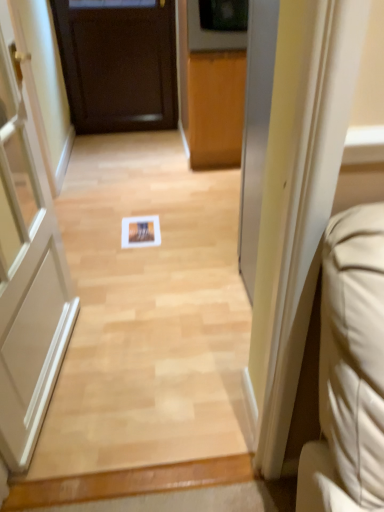
This screenshot has width=384, height=512. I want to click on white matte door at left, positioned as the 2th door in top-to-bottom order, so click(x=27, y=273).

From the picture: Measure the distance between white matte door at left, which is counted as the first door, starting from the bottom, and camera.

1.14 meters.

Describe the element at coordinates (27, 273) in the screenshot. The width and height of the screenshot is (384, 512). I see `white matte door at left, the 2th door viewed from the back` at that location.

Measure the distance between point (x=78, y=61) and camera.

Point (x=78, y=61) is 3.20 meters from camera.

Image resolution: width=384 pixels, height=512 pixels. What do you see at coordinates (118, 63) in the screenshot? I see `dark wood door at center, the 1th door viewed from the top` at bounding box center [118, 63].

Measure the distance between dark wood door at center, the 1th door viewed from the top, and camera.

dark wood door at center, the 1th door viewed from the top, is 9.84 feet away from camera.

This screenshot has height=512, width=384. I want to click on dark wood door at center, the 1th door viewed from the top, so click(118, 63).

Locate an element on the screen. This screenshot has height=512, width=384. white matte door at left, the 2th door viewed from the back is located at coordinates (27, 273).

In the image, is white matte door at left, which is counted as the first door, starting from the bottom, on the left side or the right side of dark wood door at center, which appears as the second door when ordered from the bottom?

white matte door at left, which is counted as the first door, starting from the bottom, is positioned on dark wood door at center, which appears as the second door when ordered from the bottom,'s right side.

Is white matte door at left, the 2th door viewed from the back, further to the viewer compared to dark wood door at center, the 1th door viewed from the top?

No, white matte door at left, the 2th door viewed from the back, is closer to the camera.

Which point is more forward, (49,362) or (159,29)?

Point (49,362)

From the image's perspective, would you say white matte door at left, the first door positioned from the front, is positioned over dark wood door at center, the second door viewed from the front?

No, from the image's perspective, white matte door at left, the first door positioned from the front, is not above dark wood door at center, the second door viewed from the front.

From a real-world perspective, is white matte door at left, which is counted as the first door, starting from the bottom, over dark wood door at center, which appears as the second door when ordered from the bottom?

Yes, from a real-world perspective, white matte door at left, which is counted as the first door, starting from the bottom, is over dark wood door at center, which appears as the second door when ordered from the bottom

Considering the relative sizes of white matte door at left, which is counted as the first door, starting from the bottom, and dark wood door at center, which appears as the second door when ordered from the bottom, in the image provided, is white matte door at left, which is counted as the first door, starting from the bottom, wider than dark wood door at center, which appears as the second door when ordered from the bottom,?

Yes, white matte door at left, which is counted as the first door, starting from the bottom, is wider than dark wood door at center, which appears as the second door when ordered from the bottom.

Can you confirm if white matte door at left, the first door positioned from the front, is taller than dark wood door at center, the 1th door viewed from the top?

Correct, white matte door at left, the first door positioned from the front, is much taller as dark wood door at center, the 1th door viewed from the top.

Is white matte door at left, the 2th door viewed from the back, bigger than dark wood door at center, the 1th door viewed from the top?

Correct, white matte door at left, the 2th door viewed from the back, is larger in size than dark wood door at center, the 1th door viewed from the top.

Is white matte door at left, positioned as the 2th door in top-to-bottom order, outside of dark wood door at center, the second door viewed from the front?

Yes, white matte door at left, positioned as the 2th door in top-to-bottom order, is located beyond the bounds of dark wood door at center, the second door viewed from the front.

Are white matte door at left, the 2th door viewed from the back, and dark wood door at center, which appears as the second door when ordered from the bottom, far apart?

Yes, white matte door at left, the 2th door viewed from the back, is far from dark wood door at center, which appears as the second door when ordered from the bottom.

Is white matte door at left, which is counted as the first door, starting from the bottom, oriented towards dark wood door at center, the second door viewed from the front?

No.

How different are the orientations of white matte door at left, which is counted as the first door, starting from the bottom, and dark wood door at center, the second door viewed from the front, in degrees?

There is a 83.7-degree angle between the facing directions of white matte door at left, which is counted as the first door, starting from the bottom, and dark wood door at center, the second door viewed from the front.

How far apart are white matte door at left, which is counted as the first door, starting from the bottom, and dark wood door at center, which appears as the second door when ordered from the bottom?

white matte door at left, which is counted as the first door, starting from the bottom, is 1.95 meters from dark wood door at center, which appears as the second door when ordered from the bottom.

Identify the location of door located behind the white matte door at left, positioned as the 2th door in top-to-bottom order. (118, 63).

Would you say dark wood door at center, the 1th door viewed from the back, is to the left or to the right of white matte door at left, the 2th door viewed from the back, in the picture?

From the image, it's evident that dark wood door at center, the 1th door viewed from the back, is to the left of white matte door at left, the 2th door viewed from the back.

Who is more distant, dark wood door at center, the second door viewed from the front, or white matte door at left, which is counted as the first door, starting from the bottom?

dark wood door at center, the second door viewed from the front, is further from the camera.

Which is closer, [156,16] or [46,374]?

Point [156,16] is positioned farther from the camera compared to point [46,374].

From the image's perspective, is dark wood door at center, the second door viewed from the front, below white matte door at left, which is counted as the first door, starting from the bottom?

No.

From a real-world perspective, between dark wood door at center, the 1th door viewed from the top, and white matte door at left, the 2th door viewed from the back, who is vertically higher?

From a 3D spatial view, white matte door at left, the 2th door viewed from the back, is above.

Can you confirm if dark wood door at center, the second door viewed from the front, is thinner than white matte door at left, positioned as the 2th door in top-to-bottom order?

Yes.

In terms of height, does dark wood door at center, which appears as the second door when ordered from the bottom, look taller or shorter compared to white matte door at left, positioned as the 2th door in top-to-bottom order?

In the image, dark wood door at center, which appears as the second door when ordered from the bottom, appears to be shorter than white matte door at left, positioned as the 2th door in top-to-bottom order.

Considering the relative sizes of dark wood door at center, which appears as the second door when ordered from the bottom, and white matte door at left, which is counted as the first door, starting from the bottom, in the image provided, is dark wood door at center, which appears as the second door when ordered from the bottom, bigger than white matte door at left, which is counted as the first door, starting from the bottom,?

No, dark wood door at center, which appears as the second door when ordered from the bottom, is not bigger than white matte door at left, which is counted as the first door, starting from the bottom.

Is dark wood door at center, the second door viewed from the front, spatially inside white matte door at left, the 2th door viewed from the back, or outside of it?

dark wood door at center, the second door viewed from the front, is not inside white matte door at left, the 2th door viewed from the back, it's outside.

Is there a large distance between dark wood door at center, the second door viewed from the front, and white matte door at left, positioned as the 2th door in top-to-bottom order?

Absolutely, dark wood door at center, the second door viewed from the front, is distant from white matte door at left, positioned as the 2th door in top-to-bottom order.

Is dark wood door at center, the 1th door viewed from the top, turned away from white matte door at left, the first door positioned from the front?

dark wood door at center, the 1th door viewed from the top, does not have its back to white matte door at left, the first door positioned from the front.

This screenshot has height=512, width=384. In order to click on door that appears behind the white matte door at left, the 2th door viewed from the back in this screenshot , I will do `click(118, 63)`.

I want to click on door behind the white matte door at left, the 2th door viewed from the back, so click(x=118, y=63).

Where is `door on the left of white matte door at left, the first door positioned from the front`? door on the left of white matte door at left, the first door positioned from the front is located at coordinates (118, 63).